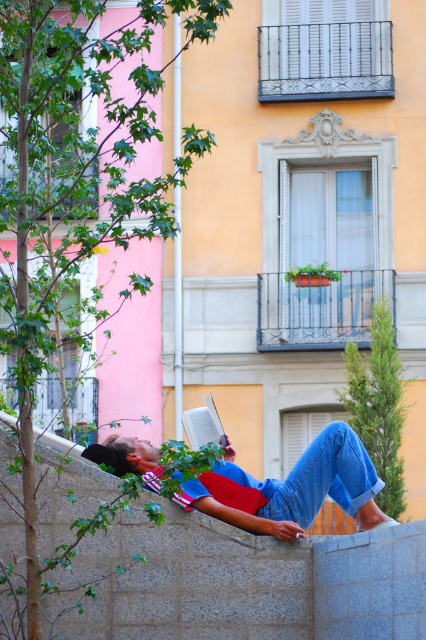
You are a photographer trying to capture the blue denim jeans at lower center and the gray concrete wall at center in a single shot. Based on their positions, which object should you adjust your camera to focus on first to ensure both are in frame?

The gray concrete wall at center is positioned on the left side of blue denim jeans at lower center, so you should focus on the gray concrete wall at center first to ensure both objects are included in the frame.